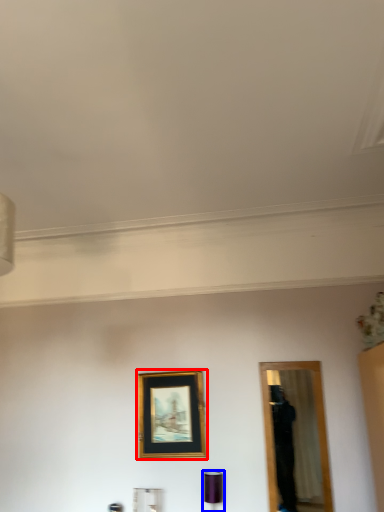
Question: Which object appears closest to the camera in this image, picture frame (highlighted by a red box) or lamp (highlighted by a blue box)?

Choices:
 (A) picture frame
 (B) lamp

Answer: (B)